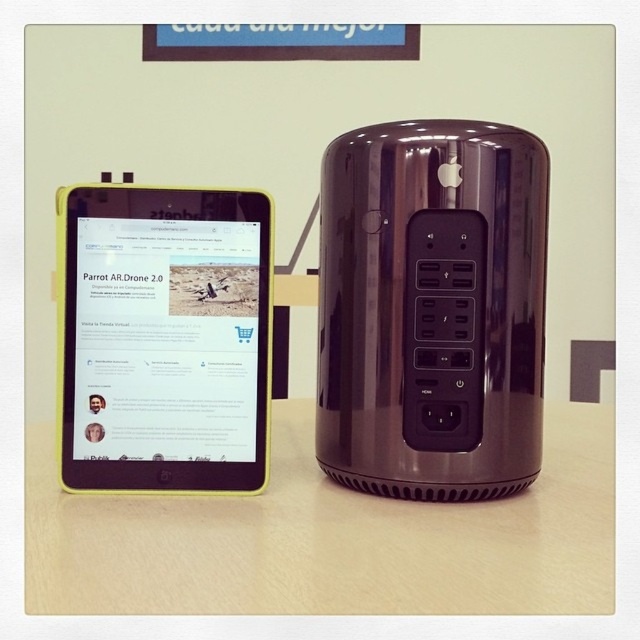
You are a delivery person who just arrived at a house to drop off a package. The package is supposed to be placed at the point with coordinates (330, 538) on the wooden table at center. You see the tablet with a yellow frame on the left and the Apple desktop computer tower on the right. Can you confirm if the package can be placed at that exact point without moving either the tablet with a yellow frame or the Apple desktop computer tower?

The point (330, 538) indicates the wooden table at center, so yes, the package can be placed at that exact point on the wooden table at center without moving the tablet with a yellow frame or the Apple desktop computer tower since the table is large enough to accommodate the package at that coordinate.

You are a delivery person placing a satin black ipod at right on a wooden table at center. Can you place it directly in front of the tablet with a yellow frame without moving the existing items?

The satin black ipod at right is further to the viewer than wooden table at center, so placing it directly in front of the tablet with a yellow frame would require moving the existing items as the ipod is already positioned closer to you than the table.

You are setting up a small electronics display and want to arrange the satin black ipod at right and the yellow plastic tablet at left so that the larger device is on the left side. Based on their sizes, should you swap their current positions?

The satin black ipod at right is larger in size than the yellow plastic tablet at left, so yes, you should swap their positions to place the larger device on the left as desired.